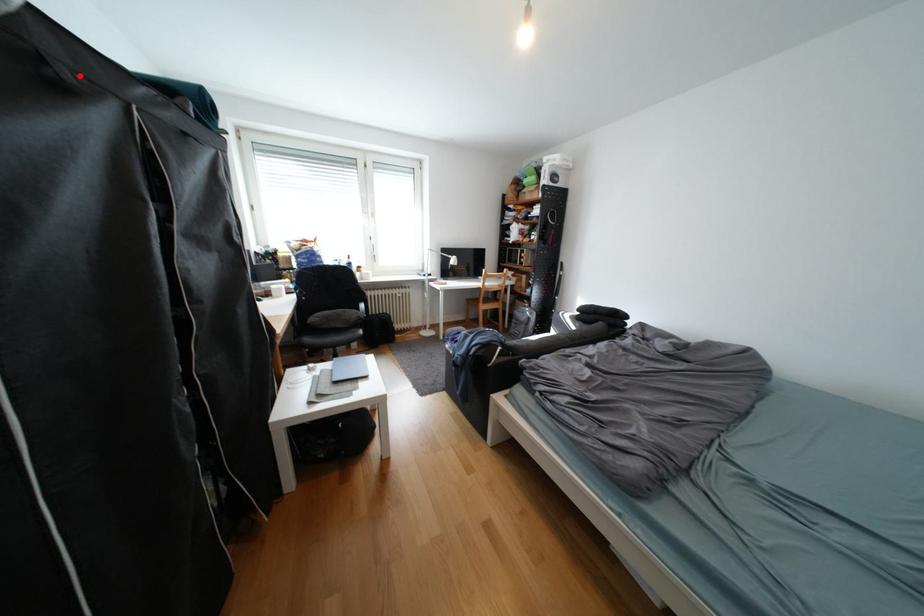
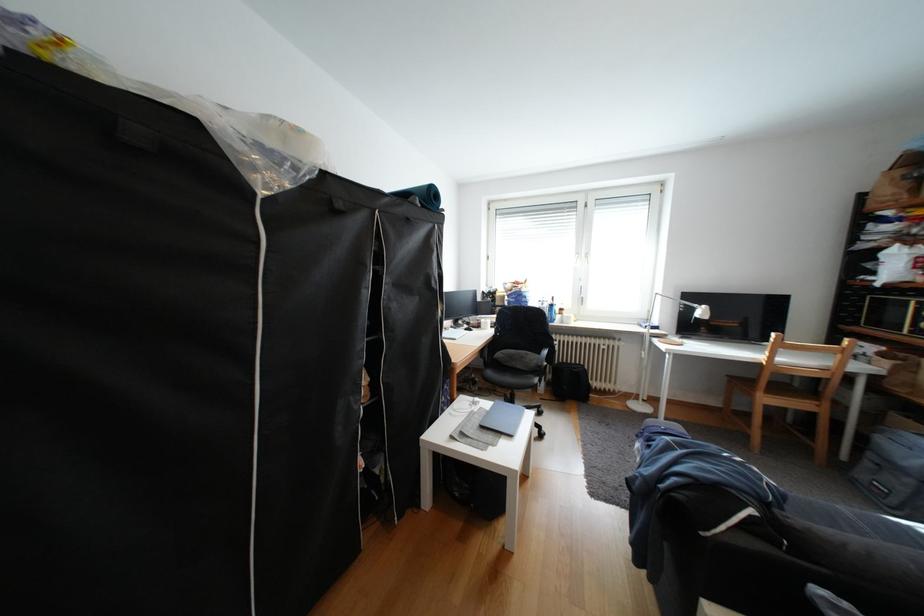
The point at the highlighted location is marked in the first image. Where is the corresponding point in the second image?

(351, 206)